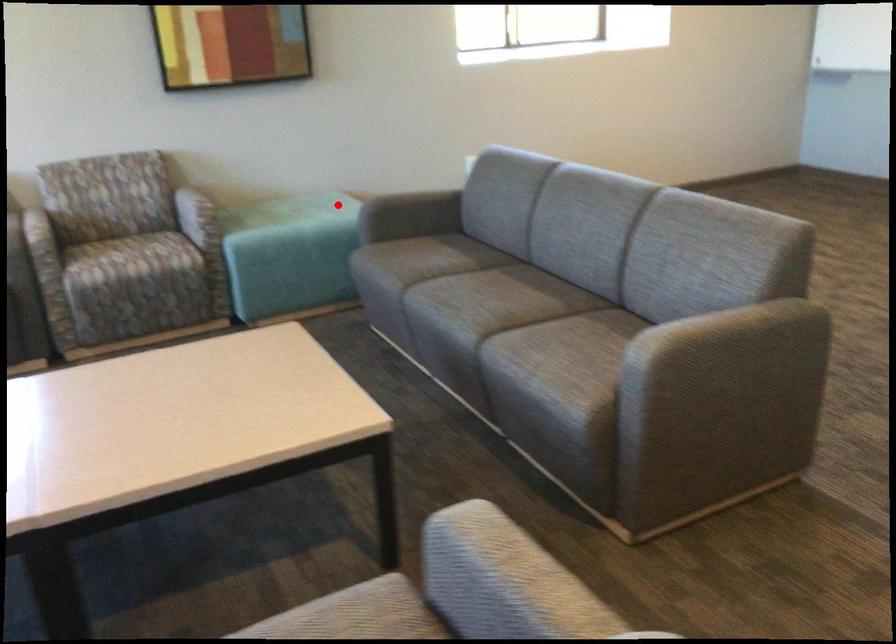
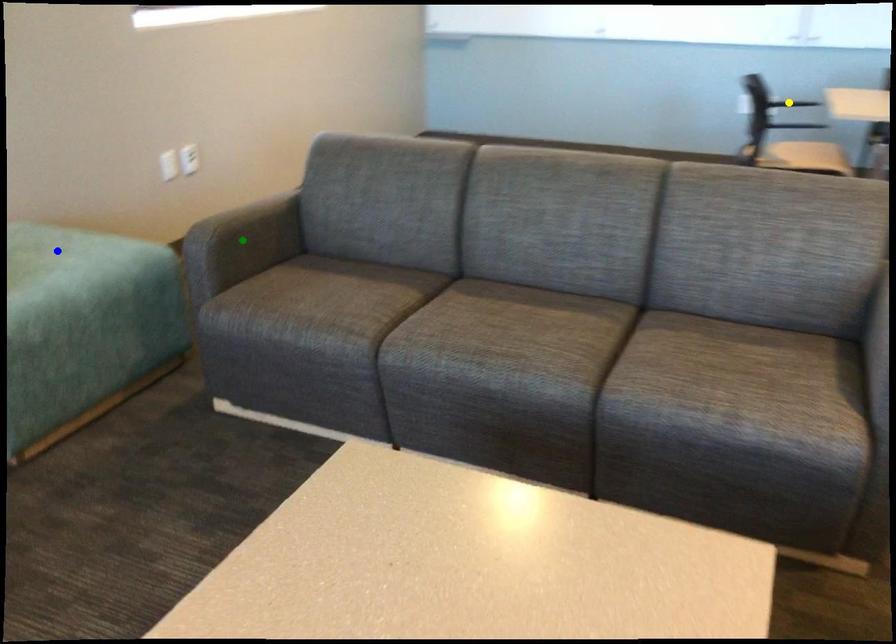
Question: I am providing you with two images of the same scene from different viewpoints. A red point is marked on the first image. You are given multiple points on the second image. In image 2, which mark is for the same physical point as the one in image 1?

Choices:
 (A) yellow point
 (B) blue point
 (C) green point

Answer: (B)